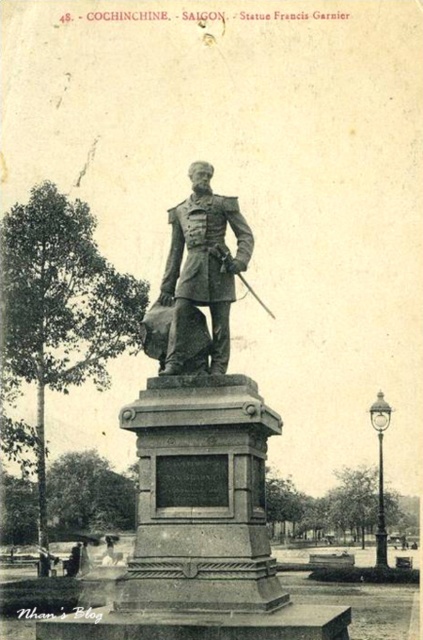
Question: Which point is farther from the camera taking this photo?

Choices:
 (A) (178, 268)
 (B) (249, 257)

Answer: (A)

Question: Is bronze statue at center further to camera compared to bronze/golden statue at center?

Choices:
 (A) yes
 (B) no

Answer: (B)

Question: Is bronze statue at center to the left of bronze/golden statue at center from the viewer's perspective?

Choices:
 (A) no
 (B) yes

Answer: (B)

Question: Among these points, which one is farthest from the camera?

Choices:
 (A) (178, 349)
 (B) (186, 385)

Answer: (A)

Question: Among these points, which one is nearest to the camera?

Choices:
 (A) (242, 436)
 (B) (217, 307)

Answer: (A)

Question: Observing the image, what is the correct spatial positioning of bronze statue at center in reference to bronze/golden statue at center?

Choices:
 (A) above
 (B) below

Answer: (B)